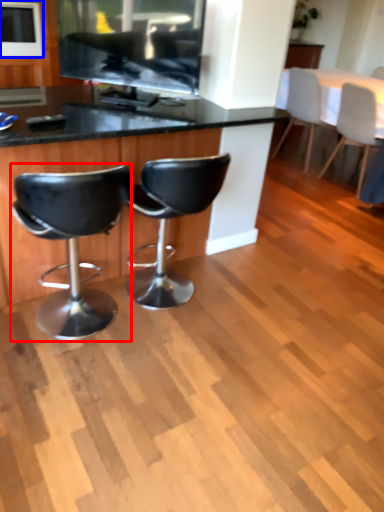
Question: Among these objects, which one is nearest to the camera, chair (highlighted by a red box) or appliance (highlighted by a blue box)?

Choices:
 (A) chair
 (B) appliance

Answer: (A)